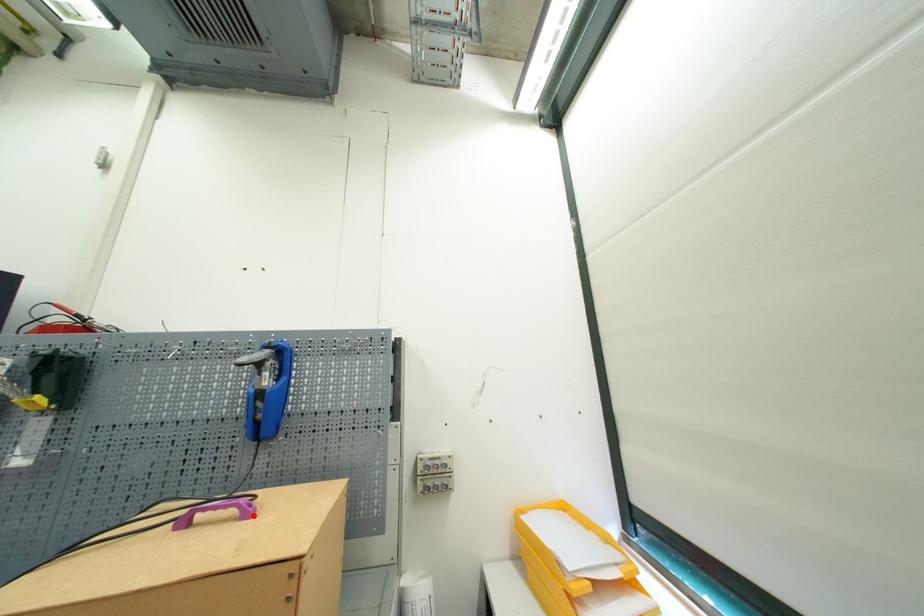
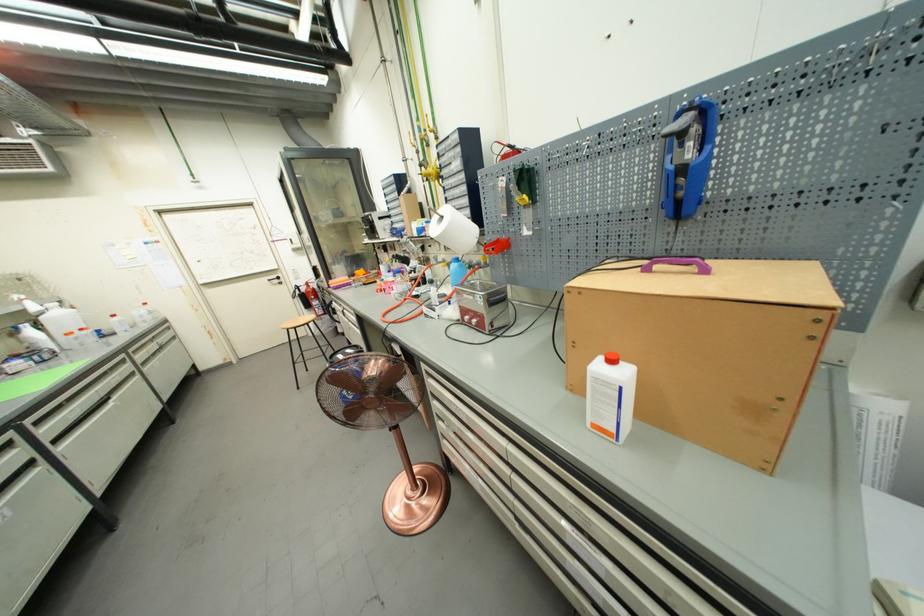
Find the pixel in the second image that matches the highlighted location in the first image.

(710, 273)